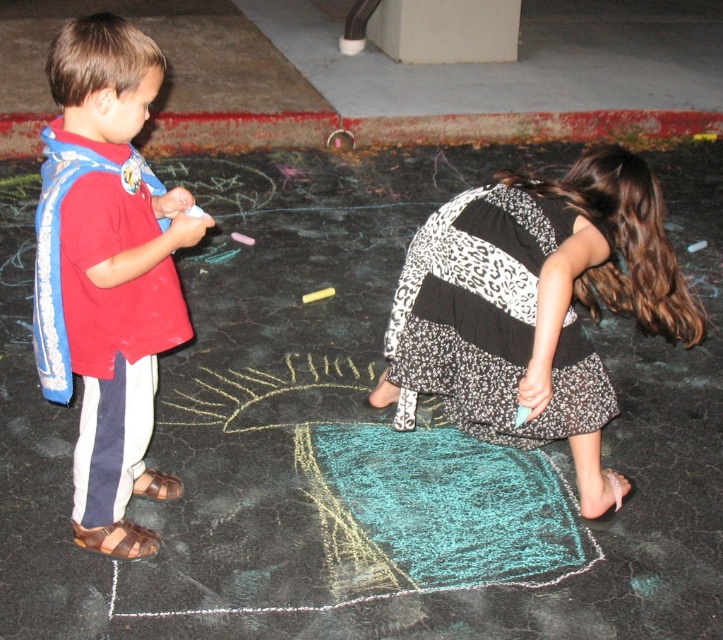
You are a parent watching your kids play outside. You see the printed fabric dress at lower right and the yellow chalk at center. Which item is bigger?

The printed fabric dress at lower right is larger in size than the yellow chalk at center.

You are a photographer standing behind the two children. You want to take a photo that includes both the matte red shirt at left and the yellow chalk at center. Which object should you focus on first to ensure both are in clear view?

The matte red shirt at left is closer to the viewer than the yellow chalk at center, so you should focus on the matte red shirt at left first to ensure both are in clear view.

You are a photographer trying to capture a photo of the yellow chalk at center without including the printed fabric dress at lower right in the frame. Based on their positions, can you position yourself in a way to achieve this?

The printed fabric dress at lower right is in front of the yellow chalk at center, so you can move to the side of the yellow chalk at center opposite to the printed fabric dress at lower right to exclude it from the frame.